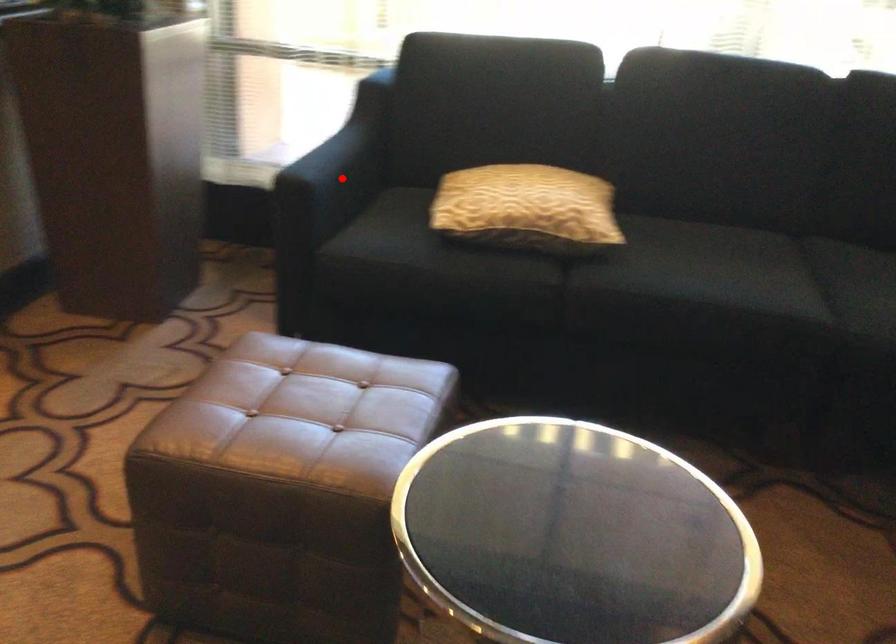
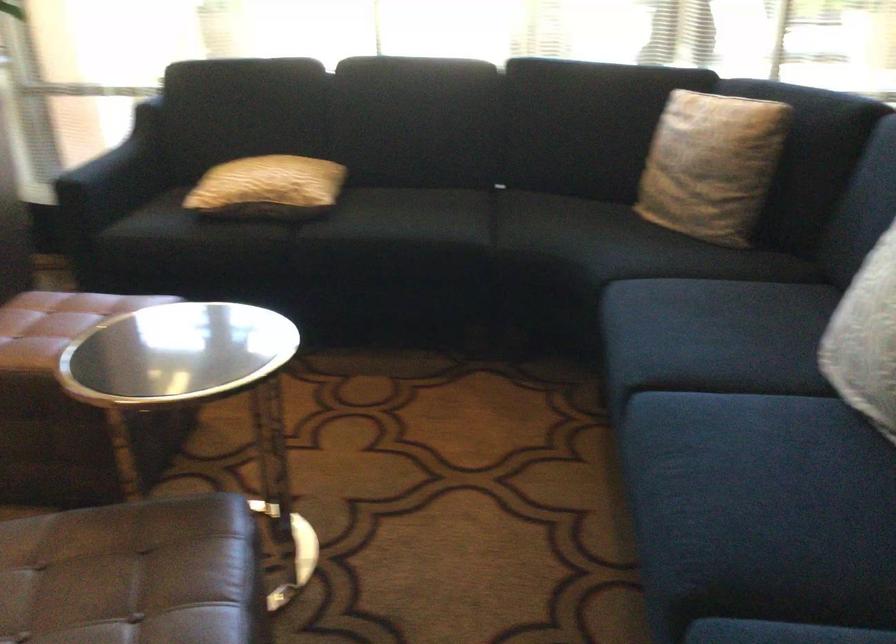
Question: I am providing you with two images of the same scene from different viewpoints. Image1 has a red point marked. In image2, the corresponding 3D location appears at what relative position? Reply with the corresponding letter.

Choices:
 (A) Closer
 (B) Farther

Answer: (B)